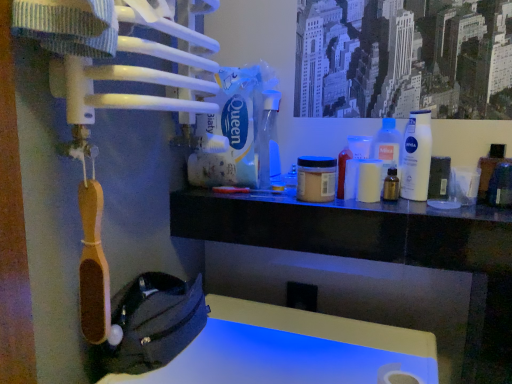
Image resolution: width=512 pixels, height=384 pixels. What do you see at coordinates (387, 145) in the screenshot?
I see `translucent plastic bottle at center right` at bounding box center [387, 145].

This screenshot has height=384, width=512. What do you see at coordinates (391, 186) in the screenshot?
I see `translucent amber bottle at center, which appears as the 2th bottle when viewed from the right` at bounding box center [391, 186].

You are a GUI agent. You are given a task and a screenshot of the screen. Output one action in this format:
    pyautogui.click(x=<x>, y=<y>)
    Task: Click on the translucent plastic bottle at center right
    
    Given the screenshot: What is the action you would take?
    pyautogui.click(x=387, y=145)

Considering the relative positions of transparent plastic spray bottle at center, the 1th bottle viewed from the left, and white plastic bottle at upper right, which appears as the third bottle when viewed from the left, in the image provided, is transparent plastic spray bottle at center, the 1th bottle viewed from the left, to the left of white plastic bottle at upper right, which appears as the third bottle when viewed from the left, from the viewer's perspective?

Correct, you'll find transparent plastic spray bottle at center, the 1th bottle viewed from the left, to the left of white plastic bottle at upper right, which appears as the third bottle when viewed from the left.

Would you say transparent plastic spray bottle at center, arranged as the third bottle when viewed from the right, is a long distance from white plastic bottle at upper right, placed as the 1th bottle when sorted from right to left?

No, transparent plastic spray bottle at center, arranged as the third bottle when viewed from the right, is not far from white plastic bottle at upper right, placed as the 1th bottle when sorted from right to left.

From a real-world perspective, is transparent plastic spray bottle at center, arranged as the third bottle when viewed from the right, on white plastic bottle at upper right, placed as the 1th bottle when sorted from right to left?

Yes.

From a real-world perspective, is white plastic bottle at upper right, which appears as the third bottle when viewed from the left, located higher than translucent plastic bottle at center right?

Yes, from a real-world perspective, white plastic bottle at upper right, which appears as the third bottle when viewed from the left, is over translucent plastic bottle at center right

Does white plastic bottle at upper right, placed as the 1th bottle when sorted from right to left, have a lesser width compared to translucent plastic bottle at center right?

In fact, white plastic bottle at upper right, placed as the 1th bottle when sorted from right to left, might be wider than translucent plastic bottle at center right.

Considering the relative sizes of white plastic bottle at upper right, which appears as the third bottle when viewed from the left, and translucent plastic bottle at center right in the image provided, is white plastic bottle at upper right, which appears as the third bottle when viewed from the left, taller than translucent plastic bottle at center right?

Indeed, white plastic bottle at upper right, which appears as the third bottle when viewed from the left, has a greater height compared to translucent plastic bottle at center right.

From the image's perspective, does white plastic bottle at upper right, which appears as the third bottle when viewed from the left, appear higher than translucent plastic bottle at center right?

Incorrect, from the image's perspective, white plastic bottle at upper right, which appears as the third bottle when viewed from the left, is lower than translucent plastic bottle at center right.

Would you say translucent amber bottle at center, which is the second bottle in left-to-right order, is part of white plastic bottle at upper right, which appears as the third bottle when viewed from the left,'s contents?

Definitely not — translucent amber bottle at center, which is the second bottle in left-to-right order, is not inside white plastic bottle at upper right, which appears as the third bottle when viewed from the left.

Can you tell me how much white plastic bottle at upper right, which appears as the third bottle when viewed from the left, and translucent amber bottle at center, which is the second bottle in left-to-right order, differ in facing direction?

The angular difference between white plastic bottle at upper right, which appears as the third bottle when viewed from the left, and translucent amber bottle at center, which is the second bottle in left-to-right order, is 17.5 degrees.

From the image's perspective, is white plastic bottle at upper right, which appears as the third bottle when viewed from the left, beneath translucent amber bottle at center, which appears as the 2th bottle when viewed from the right?

No, from the image's perspective, white plastic bottle at upper right, which appears as the third bottle when viewed from the left, is not below translucent amber bottle at center, which appears as the 2th bottle when viewed from the right.

Can you confirm if white plastic bottle at upper right, placed as the 1th bottle when sorted from right to left, is wider than translucent amber bottle at center, which appears as the 2th bottle when viewed from the right?

Indeed, white plastic bottle at upper right, placed as the 1th bottle when sorted from right to left, has a greater width compared to translucent amber bottle at center, which appears as the 2th bottle when viewed from the right.

Which point is more forward, (418, 125) or (273, 171)?

Positioned in front is point (418, 125).

Does white plastic bottle at upper right, placed as the 1th bottle when sorted from right to left, have a larger size compared to transparent plastic spray bottle at center, arranged as the third bottle when viewed from the right?

No, white plastic bottle at upper right, placed as the 1th bottle when sorted from right to left, is not bigger than transparent plastic spray bottle at center, arranged as the third bottle when viewed from the right.

Is white plastic bottle at upper right, placed as the 1th bottle when sorted from right to left, spatially inside transparent plastic spray bottle at center, the 1th bottle viewed from the left, or outside of it?

white plastic bottle at upper right, placed as the 1th bottle when sorted from right to left, is not enclosed by transparent plastic spray bottle at center, the 1th bottle viewed from the left.

Is white plastic bottle at upper right, which appears as the third bottle when viewed from the left, oriented away from transparent plastic spray bottle at center, arranged as the third bottle when viewed from the right?

white plastic bottle at upper right, which appears as the third bottle when viewed from the left, is not turned away from transparent plastic spray bottle at center, arranged as the third bottle when viewed from the right.

Is translucent amber bottle at center, which is the second bottle in left-to-right order, far from matte brown jar at center?

They are positioned close to each other.

Is translucent amber bottle at center, which appears as the 2th bottle when viewed from the right, positioned with its back to matte brown jar at center?

translucent amber bottle at center, which appears as the 2th bottle when viewed from the right, is not turned away from matte brown jar at center.

Is translucent amber bottle at center, which appears as the 2th bottle when viewed from the right, at the left side of matte brown jar at center?

No, translucent amber bottle at center, which appears as the 2th bottle when viewed from the right, is not to the left of matte brown jar at center.

From the image's perspective, which one is positioned higher, translucent amber bottle at center, which is the second bottle in left-to-right order, or matte brown jar at center?

matte brown jar at center.

Which object is positioned more to the right, transparent plastic spray bottle at center, arranged as the third bottle when viewed from the right, or translucent plastic bottle at center right?

From the viewer's perspective, translucent plastic bottle at center right appears more on the right side.

Is transparent plastic spray bottle at center, arranged as the third bottle when viewed from the right, surrounding translucent plastic bottle at center right?

No, translucent plastic bottle at center right is not surrounded by transparent plastic spray bottle at center, arranged as the third bottle when viewed from the right.

From the picture: From the image's perspective, is transparent plastic spray bottle at center, the 1th bottle viewed from the left, under translucent plastic bottle at center right?

No.

Are velvet black pouch at lower left and white plastic bottle at upper right, which appears as the third bottle when viewed from the left, far apart?

No, velvet black pouch at lower left is in close proximity to white plastic bottle at upper right, which appears as the third bottle when viewed from the left.

The width and height of the screenshot is (512, 384). I want to click on pouch beneath the white plastic bottle at upper right, placed as the 1th bottle when sorted from right to left (from a real-world perspective), so click(154, 323).

From the image's perspective, which is below, velvet black pouch at lower left or white plastic bottle at upper right, which appears as the third bottle when viewed from the left?

velvet black pouch at lower left appears lower in the image.

The height and width of the screenshot is (384, 512). In order to click on bottle above the white plastic bottle at upper right, which appears as the third bottle when viewed from the left (from a real-world perspective) in this screenshot , I will do `click(268, 141)`.

Locate an element on the screen. This screenshot has width=512, height=384. bottle to the right of translucent plastic bottle at center right is located at coordinates (416, 156).

When comparing their distances from transparent plastic spray bottle at center, arranged as the third bottle when viewed from the right, does translucent plastic bottle at center right or translucent amber bottle at center, which is the second bottle in left-to-right order, seem further?

The object further to transparent plastic spray bottle at center, arranged as the third bottle when viewed from the right, is translucent amber bottle at center, which is the second bottle in left-to-right order.

Based on their spatial positions, is white plastic bottle at upper right, placed as the 1th bottle when sorted from right to left, or velvet black pouch at lower left closer to matte brown jar at center?

white plastic bottle at upper right, placed as the 1th bottle when sorted from right to left, lies closer to matte brown jar at center than the other object.

From the picture: Looking at the image, which one is located closer to matte brown jar at center, transparent plastic spray bottle at center, arranged as the third bottle when viewed from the right, or velvet black pouch at lower left?

transparent plastic spray bottle at center, arranged as the third bottle when viewed from the right.

Estimate the real-world distances between objects in this image. Which object is closer to translucent plastic bottle at center right, velvet black pouch at lower left or white plastic bottle at upper right, placed as the 1th bottle when sorted from right to left?

white plastic bottle at upper right, placed as the 1th bottle when sorted from right to left.

From the image, which object appears to be farther from translucent amber bottle at center, which appears as the 2th bottle when viewed from the right, transparent plastic spray bottle at center, arranged as the third bottle when viewed from the right, or white plastic bottle at upper right, placed as the 1th bottle when sorted from right to left?

Among the two, transparent plastic spray bottle at center, arranged as the third bottle when viewed from the right, is located further to translucent amber bottle at center, which appears as the 2th bottle when viewed from the right.

Looking at the image, which one is located closer to white plastic bottle at upper right, placed as the 1th bottle when sorted from right to left, velvet black pouch at lower left or matte brown jar at center?

matte brown jar at center is positioned closer to the anchor white plastic bottle at upper right, placed as the 1th bottle when sorted from right to left.

Considering their positions, is matte brown jar at center positioned closer to velvet black pouch at lower left than white plastic bottle at upper right, which appears as the third bottle when viewed from the left?

matte brown jar at center is closer to velvet black pouch at lower left.

When comparing their distances from white plastic bottle at upper right, placed as the 1th bottle when sorted from right to left, does matte brown jar at center or velvet black pouch at lower left seem closer?

The object closer to white plastic bottle at upper right, placed as the 1th bottle when sorted from right to left, is matte brown jar at center.

Find the location of a particular element. mouthwash located between transparent plastic spray bottle at center, the 1th bottle viewed from the left, and translucent plastic bottle at center right in the left-right direction is located at coordinates (316, 179).

The height and width of the screenshot is (384, 512). Identify the location of bottle situated between matte brown jar at center and translucent plastic bottle at center right from left to right. pyautogui.click(x=391, y=186).

At what (x,y) coordinates should I click in order to perform the action: click on mouthwash between transparent plastic spray bottle at center, the 1th bottle viewed from the left, and velvet black pouch at lower left from top to bottom. Please return your answer as a coordinate pair (x, y). Looking at the image, I should click on (316, 179).

You are a GUI agent. You are given a task and a screenshot of the screen. Output one action in this format:
    pyautogui.click(x=<x>, y=<y>)
    Task: Click on the bottle between translucent plastic bottle at center right and translucent amber bottle at center, which is the second bottle in left-to-right order, in the up-down direction
    
    Given the screenshot: What is the action you would take?
    pyautogui.click(x=416, y=156)